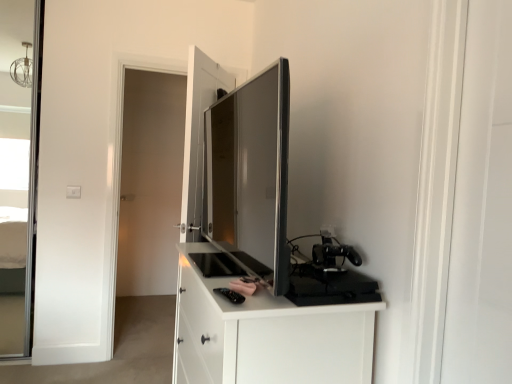
Question: Considering the relative sizes of transparent glass door at left, the second screen door in the front-to-back sequence, and black matte gaming console at right, arranged as the 1th appliance when ordered from the bottom, in the image provided, is transparent glass door at left, the second screen door in the front-to-back sequence, thinner than black matte gaming console at right, arranged as the 1th appliance when ordered from the bottom,?

Choices:
 (A) no
 (B) yes

Answer: (B)

Question: Is transparent glass door at left, the 1th screen door viewed from the back, wider than black matte gaming console at right, arranged as the 1th appliance when ordered from the bottom?

Choices:
 (A) yes
 (B) no

Answer: (B)

Question: Considering the relative positions of transparent glass door at left, the second screen door in the front-to-back sequence, and black matte gaming console at right, acting as the second appliance starting from the left, in the image provided, is transparent glass door at left, the second screen door in the front-to-back sequence, to the right of black matte gaming console at right, acting as the second appliance starting from the left, from the viewer's perspective?

Choices:
 (A) yes
 (B) no

Answer: (B)

Question: Is transparent glass door at left, which is the 2th screen door in right-to-left order, not inside black matte gaming console at right, the second appliance positioned from the top?

Choices:
 (A) no
 (B) yes

Answer: (B)

Question: Is transparent glass door at left, which is the 2th screen door in right-to-left order, positioned in front of black matte gaming console at right, the 1th appliance viewed from the right?

Choices:
 (A) no
 (B) yes

Answer: (A)

Question: In terms of size, does transparent glass door at left, the second screen door in the front-to-back sequence, appear bigger or smaller than matte black tv at center, which is the first appliance from left to right?

Choices:
 (A) small
 (B) big

Answer: (A)

Question: Is point (130, 238) positioned closer to the camera than point (205, 140)?

Choices:
 (A) farther
 (B) closer

Answer: (A)

Question: Is transparent glass door at left, the first screen door when ordered from left to right, inside or outside of matte black tv at center, the second appliance when ordered from bottom to top?

Choices:
 (A) inside
 (B) outside

Answer: (B)

Question: In the image, is transparent glass door at left, the first screen door when ordered from left to right, on the left side or the right side of matte black tv at center, which is the 2th appliance from right to left?

Choices:
 (A) right
 (B) left

Answer: (B)

Question: From a real-world perspective, is black matte gaming console at right, the 1th appliance viewed from the right, physically located above or below white matte cabinet at center?

Choices:
 (A) above
 (B) below

Answer: (A)

Question: Is black matte gaming console at right, the second appliance positioned from the top, wider or thinner than white matte cabinet at center?

Choices:
 (A) wide
 (B) thin

Answer: (B)

Question: Is point (324, 261) positioned closer to the camera than point (238, 370)?

Choices:
 (A) farther
 (B) closer

Answer: (A)

Question: In terms of height, does black matte gaming console at right, arranged as the 1th appliance when ordered from the bottom, look taller or shorter compared to white matte cabinet at center?

Choices:
 (A) short
 (B) tall

Answer: (A)

Question: Would you say white matte cabinet at center is to the left or to the right of white glossy screen door at right, the 2th screen door in the back-to-front sequence, in the picture?

Choices:
 (A) left
 (B) right

Answer: (A)

Question: Looking at their shapes, would you say white matte cabinet at center is wider or thinner than white glossy screen door at right, placed as the first screen door when sorted from front to back?

Choices:
 (A) wide
 (B) thin

Answer: (A)